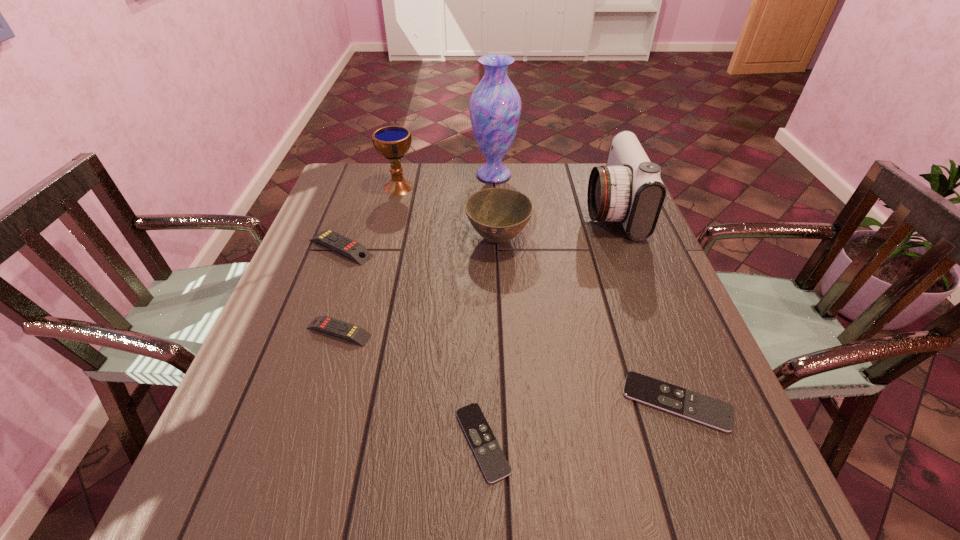
Where is `object at the far left corner`? The width and height of the screenshot is (960, 540). object at the far left corner is located at coordinates (392, 142).

You are a GUI agent. You are given a task and a screenshot of the screen. Output one action in this format:
    pyautogui.click(x=<x>, y=<y>)
    Task: Click on the object located at the far right corner
    
    Given the screenshot: What is the action you would take?
    point(628,189)

Where is `free region at the far edge of the desktop`? Image resolution: width=960 pixels, height=540 pixels. free region at the far edge of the desktop is located at coordinates (532, 167).

In the image, there is a desktop. Identify the location of vacant space at the near edge. The height and width of the screenshot is (540, 960). [444, 481].

At what (x,y) coordinates should I click in order to perform the action: click on vacant space at the left edge of the desktop. Please return your answer as a coordinate pair (x, y). This screenshot has height=540, width=960. Looking at the image, I should click on (308, 366).

Locate an element on the screen. vacant space at the right edge of the desktop is located at coordinates (641, 248).

Identify the location of vacant space at the far left corner of the desktop. The height and width of the screenshot is (540, 960). (333, 202).

Image resolution: width=960 pixels, height=540 pixels. I want to click on vacant space at the near right corner, so click(783, 523).

You are a GUI agent. You are given a task and a screenshot of the screen. Output one action in this format:
    pyautogui.click(x=<x>, y=<y>)
    Task: Click on the free spot between the smaller black remote control and the blue chalice
    The image size is (960, 540).
    Given the screenshot: What is the action you would take?
    pyautogui.click(x=441, y=314)

Find the location of `vacant point located between the purple vase and the tallest remote control`. vacant point located between the purple vase and the tallest remote control is located at coordinates pos(418,212).